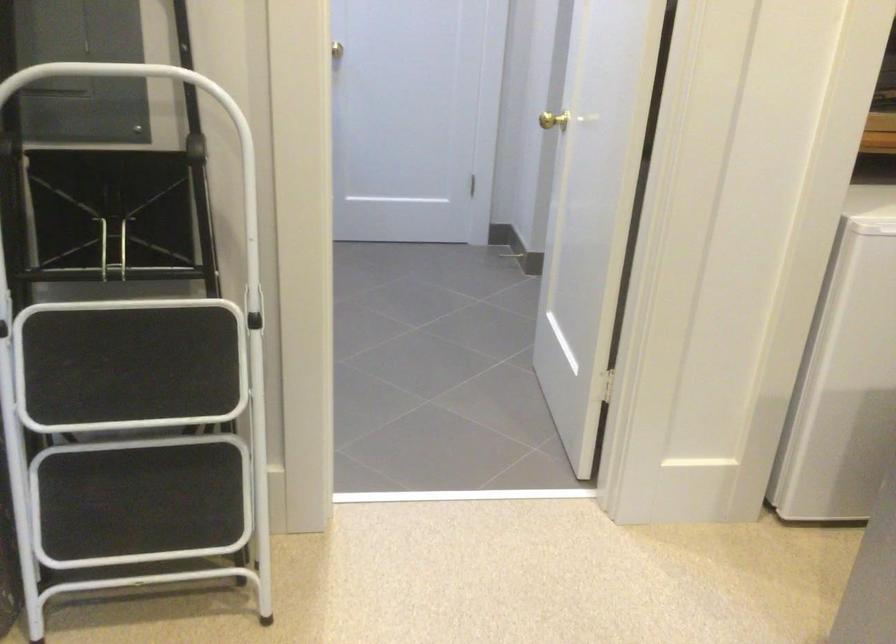
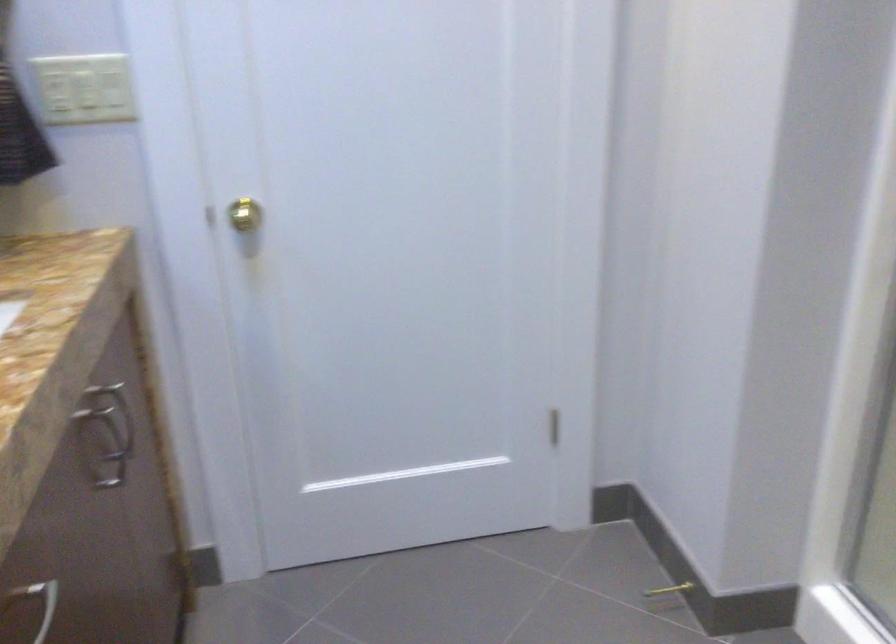
Question: In a continuous first-person perspective shot, in which direction is the camera moving?

Choices:
 (A) Left
 (B) Right
 (C) Forward
 (D) Backward

Answer: (C)